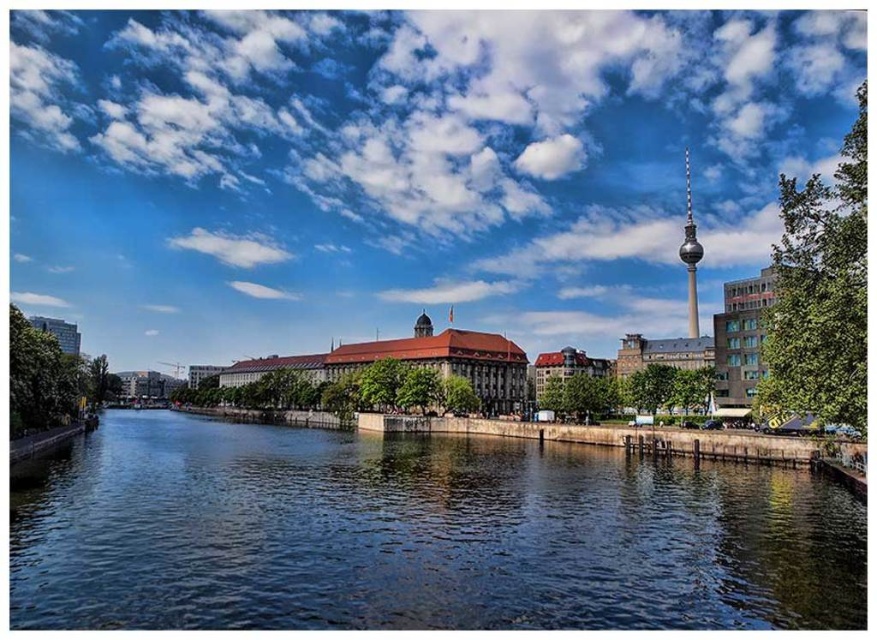
Is dark blue water at center closer to the viewer compared to shiny silver tower at upper center?

Yes, it is.

Does point (262, 529) lie in front of point (686, 276)?

Yes.

You are a GUI agent. You are given a task and a screenshot of the screen. Output one action in this format:
    pyautogui.click(x=<x>, y=<y>)
    Task: Click on the dark blue water at center
    This screenshot has height=640, width=877.
    Given the screenshot: What is the action you would take?
    pyautogui.click(x=419, y=536)